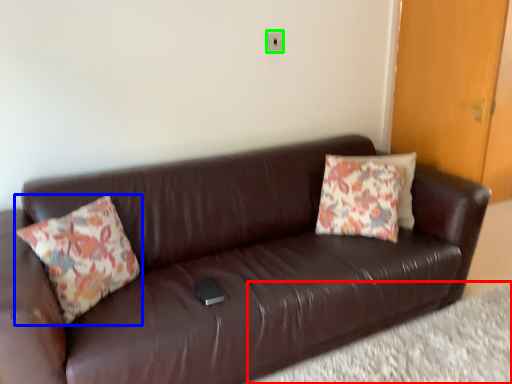
Question: Based on their relative distances, which object is nearer to plain (highlighted by a red box)? Choose from pillow (highlighted by a blue box) and electric outlet (highlighted by a green box).

Choices:
 (A) pillow
 (B) electric outlet

Answer: (A)